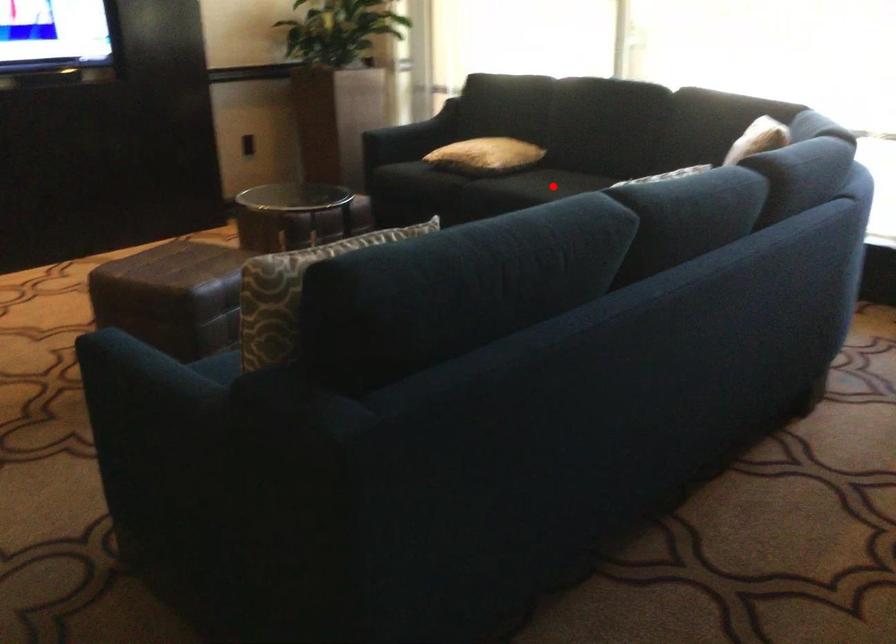
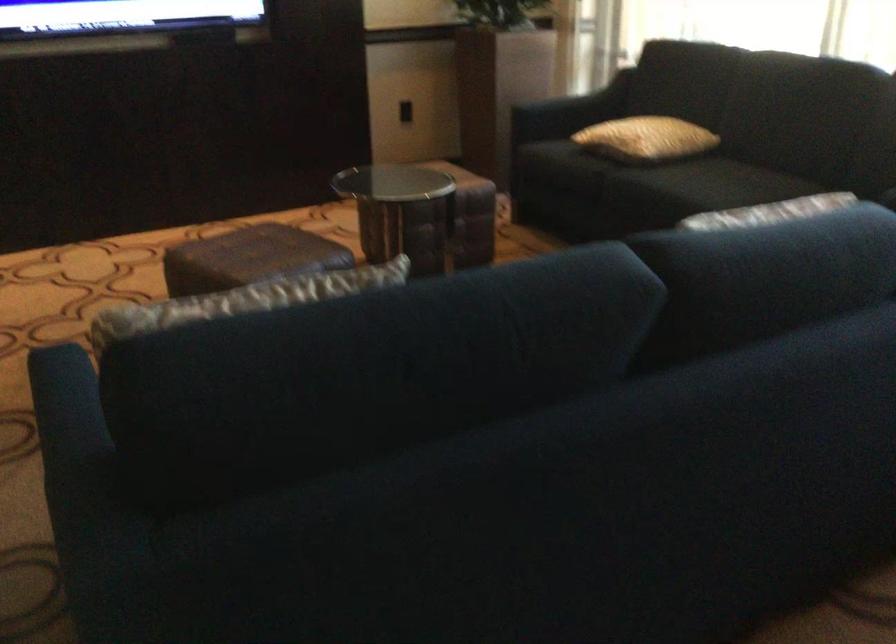
Question: I am providing you with two images of the same scene from different viewpoints. A red point is marked on the first image. Is the red point's position out of view in image 2?

Choices:
 (A) Yes
 (B) No

Answer: (B)